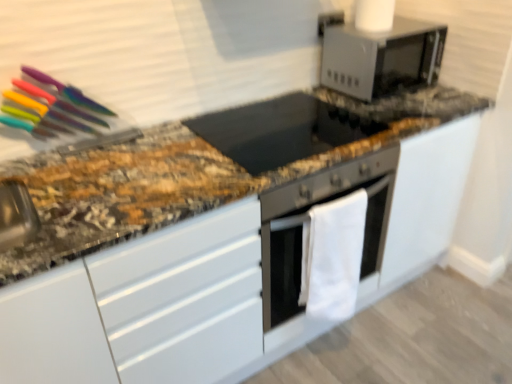
Question: Is the surface of white fabric oven at center in direct contact with black glass cooktop at center?

Choices:
 (A) no
 (B) yes

Answer: (A)

Question: Is black glass cooktop at center completely or partially inside white fabric oven at center?

Choices:
 (A) yes
 (B) no

Answer: (B)

Question: From the image's perspective, does white fabric oven at center appear higher than black glass cooktop at center?

Choices:
 (A) no
 (B) yes

Answer: (A)

Question: Is white fabric oven at center located outside black glass cooktop at center?

Choices:
 (A) yes
 (B) no

Answer: (A)

Question: From a real-world perspective, is white fabric oven at center positioned over black glass cooktop at center based on gravity?

Choices:
 (A) yes
 (B) no

Answer: (B)

Question: From the image's perspective, would you say white fabric oven at center is shown under black glass cooktop at center?

Choices:
 (A) yes
 (B) no

Answer: (A)

Question: From a real-world perspective, is black glass cooktop at center physically above white fabric oven at center?

Choices:
 (A) yes
 (B) no

Answer: (A)

Question: Is black glass cooktop at center beside white fabric oven at center?

Choices:
 (A) yes
 (B) no

Answer: (B)

Question: Does black glass cooktop at center have a lesser height compared to white fabric oven at center?

Choices:
 (A) no
 (B) yes

Answer: (B)

Question: Is black glass cooktop at center bigger than white fabric oven at center?

Choices:
 (A) no
 (B) yes

Answer: (A)

Question: Is black glass cooktop at center looking in the opposite direction of white fabric oven at center?

Choices:
 (A) no
 (B) yes

Answer: (A)

Question: Does black glass cooktop at center appear on the left side of white fabric oven at center?

Choices:
 (A) yes
 (B) no

Answer: (A)

Question: Can you confirm if satin silver microwave at upper right is positioned to the right of white fabric oven at center?

Choices:
 (A) no
 (B) yes

Answer: (B)